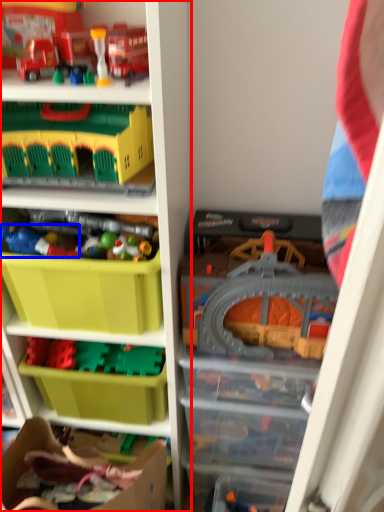
Question: Which object appears farthest to the camera in this image, shelf (highlighted by a red box) or toy (highlighted by a blue box)?

Choices:
 (A) shelf
 (B) toy

Answer: (B)